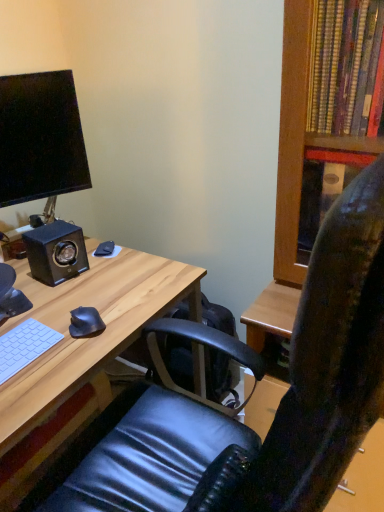
The height and width of the screenshot is (512, 384). In order to click on vacant space behind black matte mouse at lower left, marked as the second mouse in a top-to-bottom arrangement in this screenshot , I will do `click(110, 294)`.